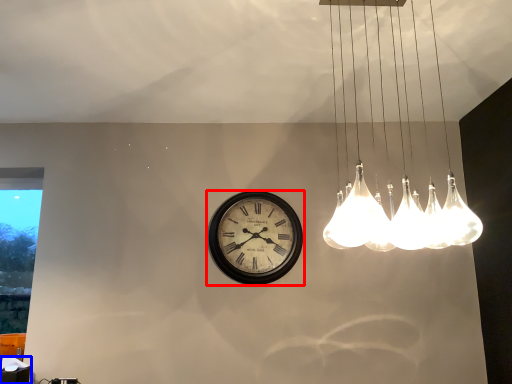
Question: Which point is further to the camera, wall clock (highlighted by a red box) or table (highlighted by a blue box)?

Choices:
 (A) wall clock
 (B) table

Answer: (A)